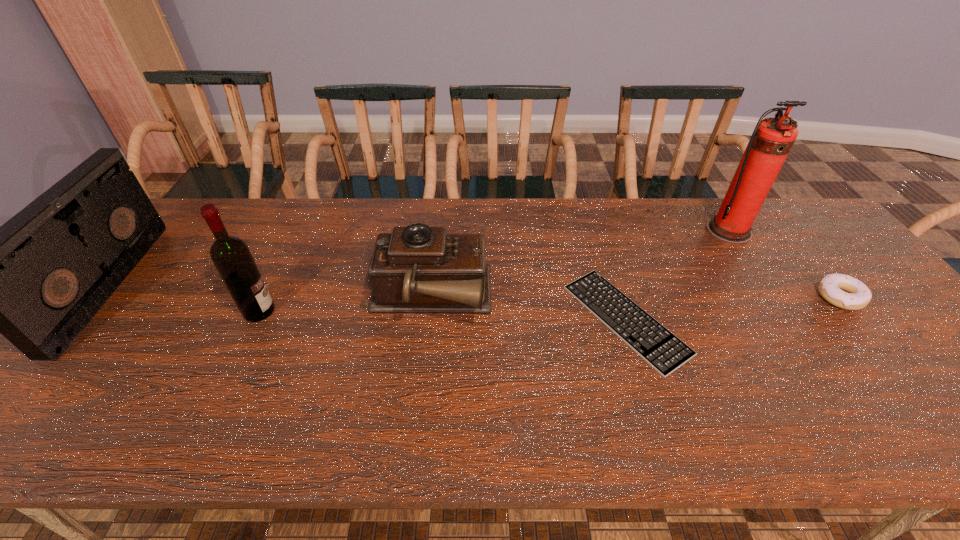
The width and height of the screenshot is (960, 540). Identify the location of the third object from right to left. (659, 347).

Locate an element on the screen. free location located 0.320m at the discharge end of the tallest object is located at coordinates (791, 327).

Find the location of a particular element. vacant point located 0.260m on the front and back of the second object from left to right is located at coordinates (376, 311).

The height and width of the screenshot is (540, 960). I want to click on vacant space situated on the front side of the fourth shortest object, so click(x=156, y=285).

Where is `vacant space situated on the horn of the third shortest object`? The width and height of the screenshot is (960, 540). vacant space situated on the horn of the third shortest object is located at coordinates (560, 298).

Where is `vacant position located 0.180m on the back of the fifth tallest object`? This screenshot has height=540, width=960. vacant position located 0.180m on the back of the fifth tallest object is located at coordinates (794, 240).

The width and height of the screenshot is (960, 540). What are the coordinates of `free space located 0.370m on the left of the third object from right to left` in the screenshot? It's located at 422,320.

At what (x,y) coordinates should I click in order to perform the action: click on fire extinguisher located in the far edge section of the desktop. Please return your answer as a coordinate pair (x, y). This screenshot has height=540, width=960. Looking at the image, I should click on (772, 139).

This screenshot has height=540, width=960. In order to click on videotape that is at the far edge in this screenshot , I will do `click(39, 279)`.

Identify the location of object present at the left edge. The height and width of the screenshot is (540, 960). (39, 279).